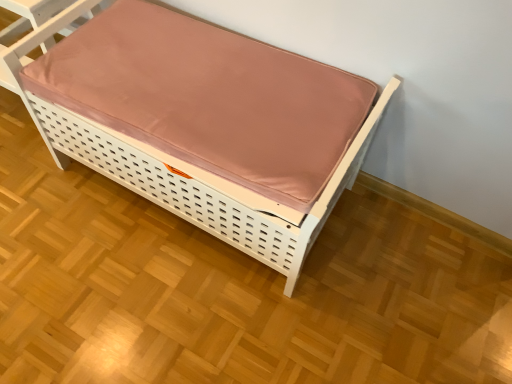
Question: Should I look upward or downward to see matte pink mattress at center?

Choices:
 (A) down
 (B) up

Answer: (B)